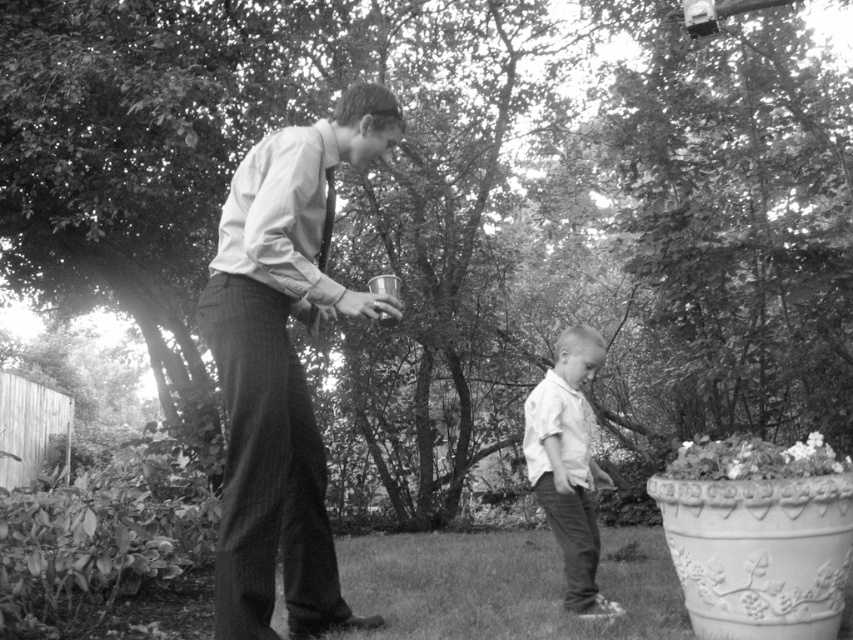
You are standing in the garden scene and notice the matte white shirt at center. Can you determine its exact location using the coordinate system provided?

The matte white shirt at center is located at point (282, 365) according to the coordinate system provided.

You are taking a photo of two points in the garden scene described. The first point is at coordinate point (286, 128) and the second is at point (584, 410). Which point is closer to the camera?

Point (286, 128) is closer to the camera than point (584, 410) because it is further to the camera than the latter according to the description.